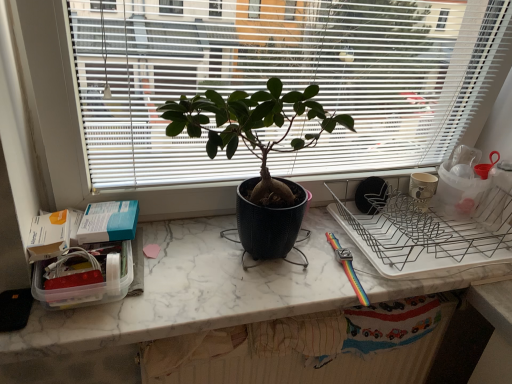
What do you see at coordinates (198, 300) in the screenshot?
I see `white marble countertop at center` at bounding box center [198, 300].

Where is `matte black plant at center`? This screenshot has width=512, height=384. matte black plant at center is located at coordinates (283, 78).

Between matte black pot at center and matte black plant at center, which one has smaller size?

matte black pot at center is smaller.

From a real-world perspective, between matte black pot at center and matte black plant at center, who is vertically higher?

matte black plant at center, from a real-world perspective.

Is matte black pot at center beside matte black plant at center?

They are not placed beside each other.

Looking at their sizes, would you say white marble countertop at center is wider or thinner than matte black plant at center?

In the image, white marble countertop at center appears to be wider than matte black plant at center.

Image resolution: width=512 pixels, height=384 pixels. Find the location of `window that appears on the left of white marble countertop at center`. window that appears on the left of white marble countertop at center is located at coordinates (283, 78).

Does point (259, 271) come closer to viewer compared to point (172, 18)?

That is False.

Which of these two, white marble countertop at center or matte black plant at center, stands taller?

matte black plant at center is taller.

Considering the sizes of matte black plant at center and matte black pot at center in the image, is matte black plant at center wider or thinner than matte black pot at center?

Clearly, matte black plant at center has more width compared to matte black pot at center.

Between matte black plant at center and matte black pot at center, which one appears on the right side from the viewer's perspective?

matte black plant at center.

Find the location of a particular element. This screenshot has width=512, height=384. computer desk below the matte black plant at center (from the image's perspective) is located at coordinates [x=198, y=300].

Considering the relative sizes of matte black plant at center and white marble countertop at center in the image provided, is matte black plant at center smaller than white marble countertop at center?

Incorrect, matte black plant at center is not smaller in size than white marble countertop at center.

How different are the orientations of matte black plant at center and white marble countertop at center in degrees?

0.00129 degrees separate the facing orientations of matte black plant at center and white marble countertop at center.

Is matte black plant at center positioned far away from white marble countertop at center?

No.

Does matte black pot at center have a greater width compared to white marble countertop at center?

No, matte black pot at center is not wider than white marble countertop at center.

Is matte black pot at center next to white marble countertop at center and touching it?

No.

Which is in front, point (228, 120) or point (157, 288)?

Point (228, 120)

Considering the sizes of objects matte black pot at center and white marble countertop at center in the image provided, who is shorter, matte black pot at center or white marble countertop at center?

Standing shorter between the two is white marble countertop at center.

From the image's perspective, relative to matte black pot at center, is white marble countertop at center above or below?

Based on their image positions, white marble countertop at center is located beneath matte black pot at center.

In the scene shown: Based on their positions, is white marble countertop at center located to the left or right of matte black pot at center?

Based on their positions, white marble countertop at center is located to the right of matte black pot at center.

Is white marble countertop at center placed right next to matte black pot at center?

white marble countertop at center and matte black pot at center are not in contact.

From a real-world perspective, between white marble countertop at center and matte black pot at center, who is vertically lower?

In real-world perspective, white marble countertop at center is lower.

At what (x,y) coordinates should I click in order to perform the action: click on window that is above the matte black pot at center (from the image's perspective). Please return your answer as a coordinate pair (x, y). This screenshot has height=384, width=512. Looking at the image, I should click on (283, 78).

At what (x,y) coordinates should I click in order to perform the action: click on computer desk below the matte black plant at center (from the image's perspective). Please return your answer as a coordinate pair (x, y). This screenshot has width=512, height=384. Looking at the image, I should click on (198, 300).

From the image, which object appears to be nearer to matte black pot at center, white marble countertop at center or matte black plant at center?

Among the two, matte black plant at center is located nearer to matte black pot at center.

Based on their spatial positions, is matte black plant at center or matte black pot at center closer to white marble countertop at center?

Based on the image, matte black pot at center appears to be nearer to white marble countertop at center.

Considering their positions, is white marble countertop at center positioned closer to matte black plant at center than matte black pot at center?

→ Based on the image, matte black pot at center appears to be nearer to matte black plant at center.

Based on their spatial positions, is matte black pot at center or white marble countertop at center closer to matte black plant at center?

matte black pot at center.

When comparing their distances from white marble countertop at center, does matte black pot at center or matte black plant at center seem further?

matte black plant at center is positioned further to the anchor white marble countertop at center.

Estimate the real-world distances between objects in this image. Which object is further from matte black pot at center, matte black plant at center or white marble countertop at center?

Based on the image, white marble countertop at center appears to be further to matte black pot at center.

The width and height of the screenshot is (512, 384). I want to click on houseplant between matte black plant at center and white marble countertop at center vertically, so click(x=257, y=154).